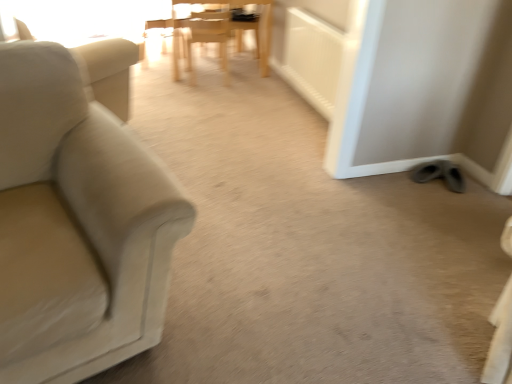
Question: From a real-world perspective, is wooden chair at center, the second chair in the top-to-bottom sequence, above or below beige fabric swivel chair at left?

Choices:
 (A) below
 (B) above

Answer: (A)

Question: In the image, is wooden chair at center, the 2th chair positioned from the bottom, positioned in front of or behind beige fabric swivel chair at left?

Choices:
 (A) behind
 (B) front

Answer: (A)

Question: Estimate the real-world distances between objects in this image. Which object is farther from the beige fabric swivel chair at left?

Choices:
 (A) wooden chair at center, the 2th chair positioned from the bottom
 (B) beige fabric couch at left, which is the 1th chair in front-to-back order
 (C) wooden chair at center, the 1th chair viewed from the back
 (D) gray suede shoes at lower right

Answer: (D)

Question: Estimate the real-world distances between objects in this image. Which object is closer to the gray suede shoes at lower right?

Choices:
 (A) wooden chair at center, the 1th chair viewed from the back
 (B) wooden chair at center, the 2th chair positioned from the bottom
 (C) beige fabric couch at left, arranged as the third chair when viewed from the back
 (D) beige fabric swivel chair at left

Answer: (D)